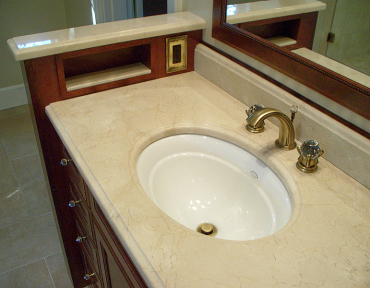
You are a GUI agent. You are given a task and a screenshot of the screen. Output one action in this format:
    pyautogui.click(x=<x>, y=<y>)
    Task: Click on the hot water valve
    The height and width of the screenshot is (288, 370).
    Given the screenshot: What is the action you would take?
    pyautogui.click(x=251, y=107)